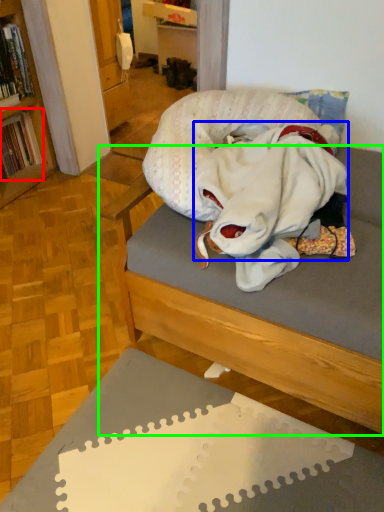
Question: Which object is the farthest from book (highlighted by a red box)? Choose among these: clothing (highlighted by a blue box) or studio couch (highlighted by a green box).

Choices:
 (A) clothing
 (B) studio couch

Answer: (B)